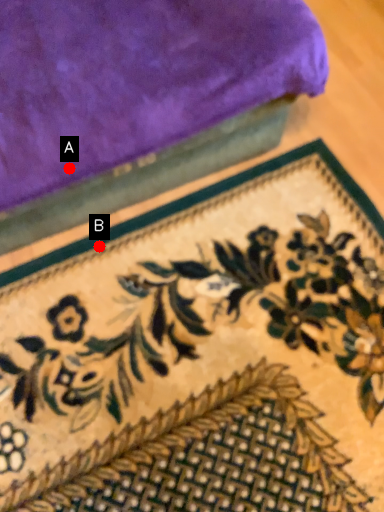
Question: Two points are circled on the image, labeled by A and B beside each circle. Which point appears closest to the camera in this image?

Choices:
 (A) A is closer
 (B) B is closer

Answer: (A)